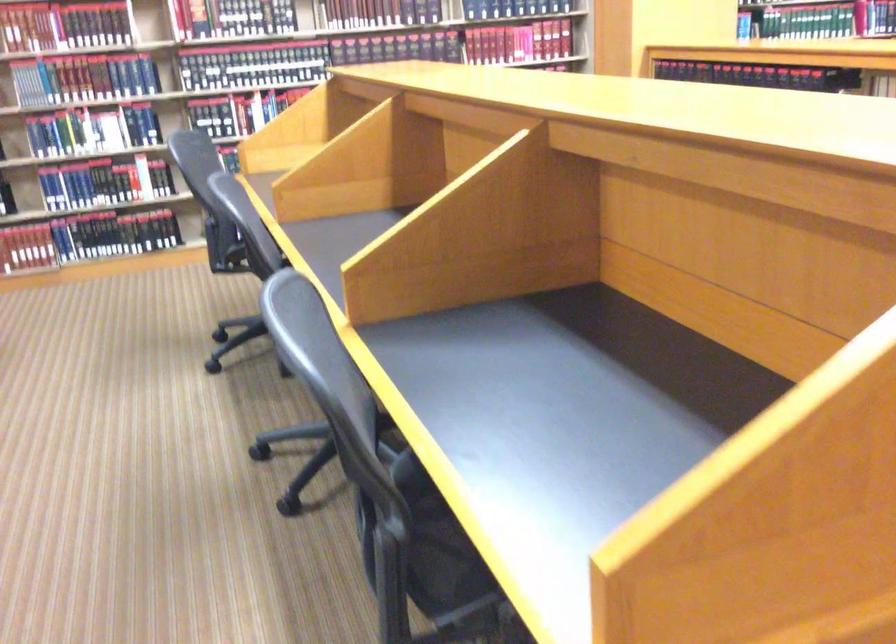
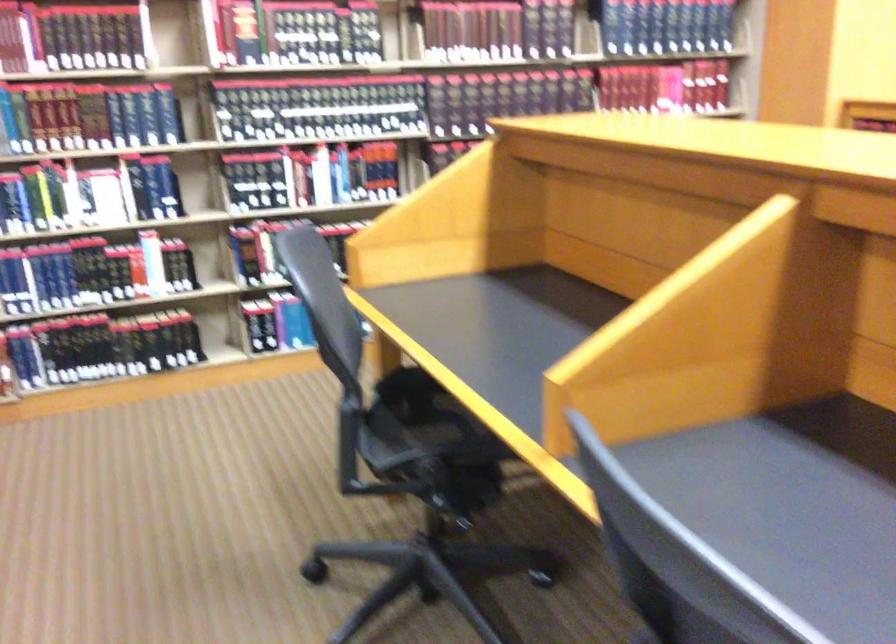
In a continuous first-person perspective shot, in which direction is the camera moving?

The cameraman walked toward left, forward.